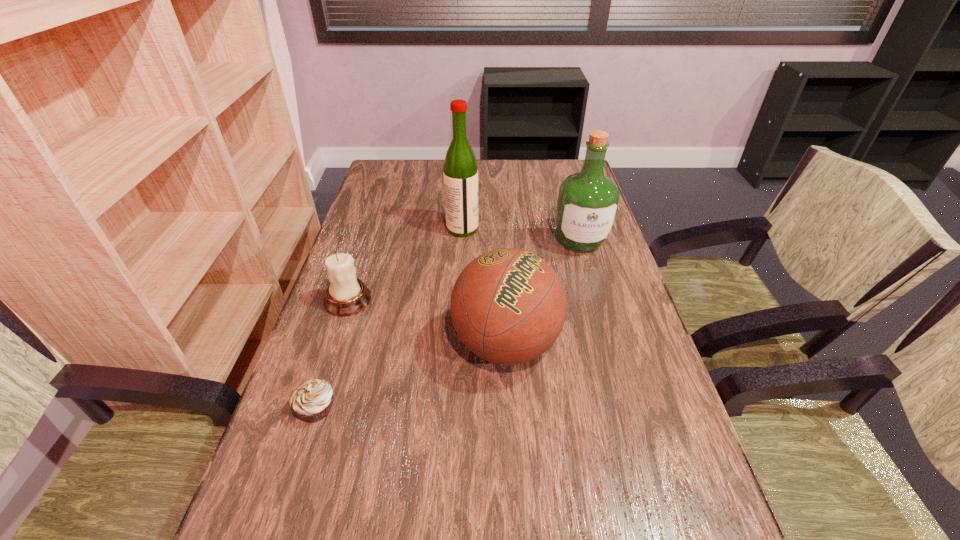
Image resolution: width=960 pixels, height=540 pixels. Identify the location of unoccupied position between the muffin and the third tallest object. (411, 376).

At what (x,y) coordinates should I click in order to perform the action: click on vacant region between the nearest object and the right liquor. Please return your answer as a coordinate pair (x, y). This screenshot has width=960, height=540. Looking at the image, I should click on (448, 325).

I want to click on free space between the shortest object and the right liquor, so click(448, 325).

Where is `the third closest object to the left liquor`? The image size is (960, 540). the third closest object to the left liquor is located at coordinates (508, 306).

Locate an element on the screen. This screenshot has height=540, width=960. the fourth closest object to the shortest object is located at coordinates (588, 201).

The image size is (960, 540). In order to click on vacant space that satisfies the following two spatial constraints: 1. on the label of the basketball; 2. on the left side of the left liquor in this screenshot , I will do `click(456, 344)`.